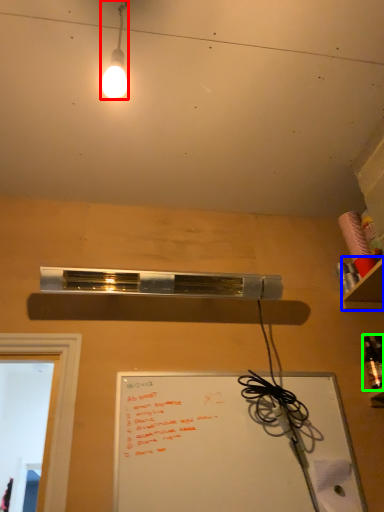
Question: Considering the real-world distances, which object is closest to lamp (highlighted by a red box)? shelf (highlighted by a blue box) or bottle (highlighted by a green box).

Choices:
 (A) shelf
 (B) bottle

Answer: (A)